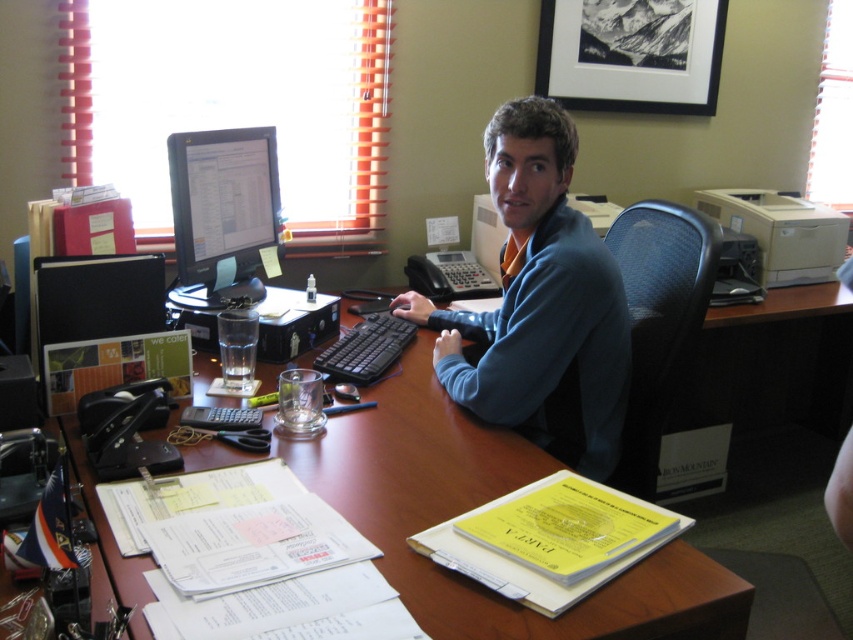
You are organizing your desk and need to place a new laptop that is the same size as the matte black monitor at center. Can the brown wood computer desk at center accommodate the laptop?

The brown wood computer desk at center is bigger than the matte black monitor at center, so yes, the desk can accommodate the laptop since it has enough space.

Looking at this image, you are an office worker who just arrived at your desk. You need to place a new folder on the desk. The folder is 10 cm wide. The desk has a free space at point [540,305]. Can you fit the folder there?

The free space at point [540,305] is occupied by a blue cotton shirt at center, so you cannot place the folder there.

You are an office worker who needs to place a new folder on the desk. The folder is slightly larger than the blue cotton shirt at center. Will it fit on the desk without overlapping the matte black monitor at center?

The blue cotton shirt at center is larger than the matte black monitor at center. Since the folder is larger than the blue cotton shirt at center, it would be bigger than the monitor. However, the desk is cluttered with items like folders, binders, a glass of water, calculator, scissors, and scattered papers. To place the folder without overlapping the monitor, you should check if there is enough space elsewhere on the desk besides the area near the monitor.